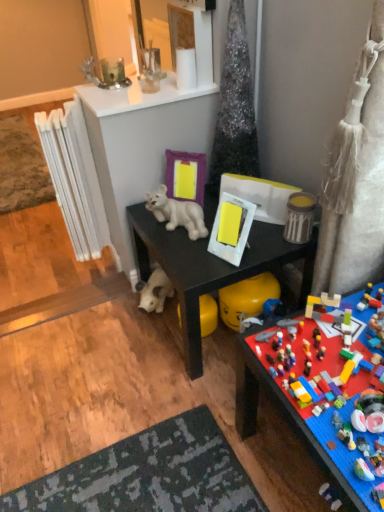
I want to click on free region on the left part of white glossy picture frame at center, which is the 1th picture frame in front-to-back order, so click(x=192, y=256).